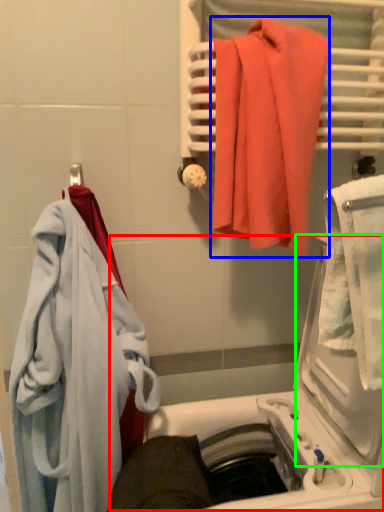
Question: Considering the real-world distances, which object is closest to dish washer (highlighted by a red box)? towel (highlighted by a blue box) or screen door (highlighted by a green box).

Choices:
 (A) towel
 (B) screen door

Answer: (B)